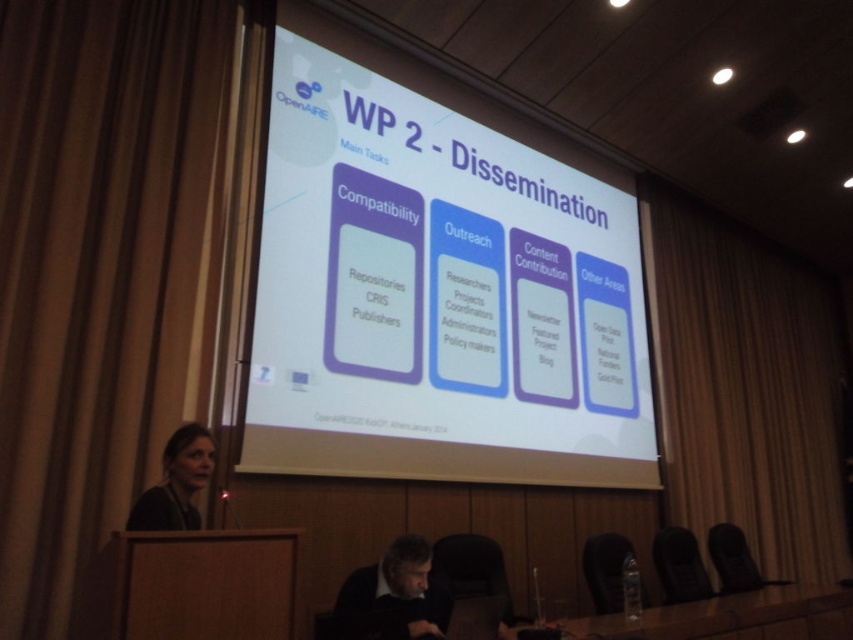
Does white glossy projector screen at center appear over transparent plastic table at lower center?

Indeed, white glossy projector screen at center is positioned over transparent plastic table at lower center.

Measure the distance between point (245, 448) and camera.

Point (245, 448) and camera are 3.37 meters apart from each other.

Find the location of a particular element. This screenshot has width=853, height=640. white glossy projector screen at center is located at coordinates (439, 291).

Does white glossy projector screen at center lie behind matte black hair at lower left?

Yes.

Can you confirm if white glossy projector screen at center is taller than matte black hair at lower left?

Yes, white glossy projector screen at center is taller than matte black hair at lower left.

Consider the image. Who is more distant from viewer, (461, 316) or (200, 451)?

The point (461, 316) is behind.

Locate an element on the screen. white glossy projector screen at center is located at coordinates (439, 291).

Is point (700, 625) positioned after point (363, 600)?

Yes, it is.

From the picture: Does transparent plastic table at lower center appear over dark brown leather jacket at lower center?

Incorrect, transparent plastic table at lower center is not positioned above dark brown leather jacket at lower center.

The width and height of the screenshot is (853, 640). What do you see at coordinates (733, 618) in the screenshot?
I see `transparent plastic table at lower center` at bounding box center [733, 618].

Locate an element on the screen. The height and width of the screenshot is (640, 853). transparent plastic table at lower center is located at coordinates (733, 618).